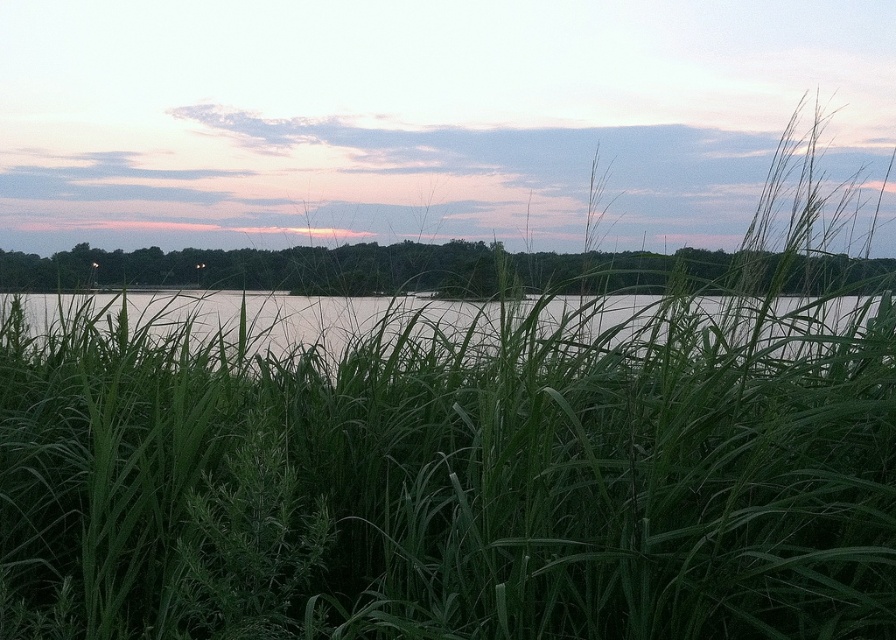
Which of these two, green grass at center or clear water at center, stands shorter?

green grass at center is shorter.

Is green grass at center bigger than clear water at center?

Incorrect, green grass at center is not larger than clear water at center.

Describe the element at coordinates (385, 269) in the screenshot. I see `green grass at center` at that location.

Find the location of `green grass at center`. green grass at center is located at coordinates (385, 269).